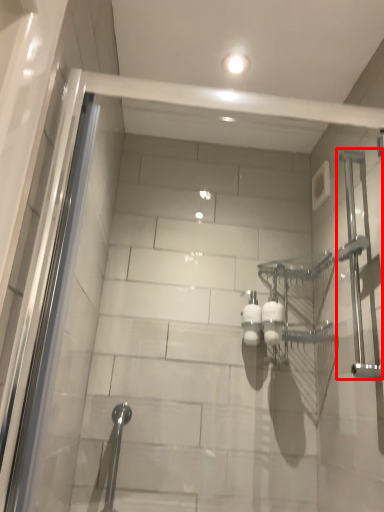
Question: Where is shower (annotated by the red box) located in relation to shower in the image?

Choices:
 (A) right
 (B) left

Answer: (A)